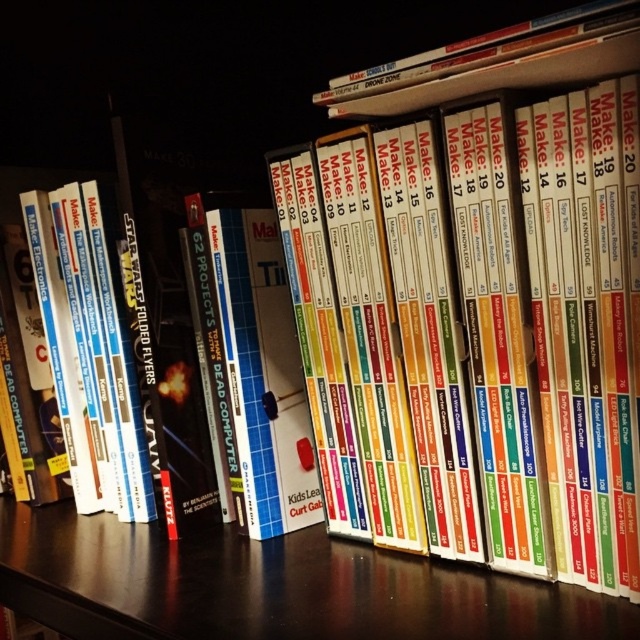
Can you confirm if black wood table at center is positioned to the left of hardcover book at upper center?

Yes, black wood table at center is to the left of hardcover book at upper center.

From the picture: Is black wood table at center bigger than hardcover book at upper center?

Yes.

Who is more distant from viewer, (292, 593) or (474, 83)?

The point (292, 593) is behind.

The width and height of the screenshot is (640, 640). I want to click on black wood table at center, so click(269, 588).